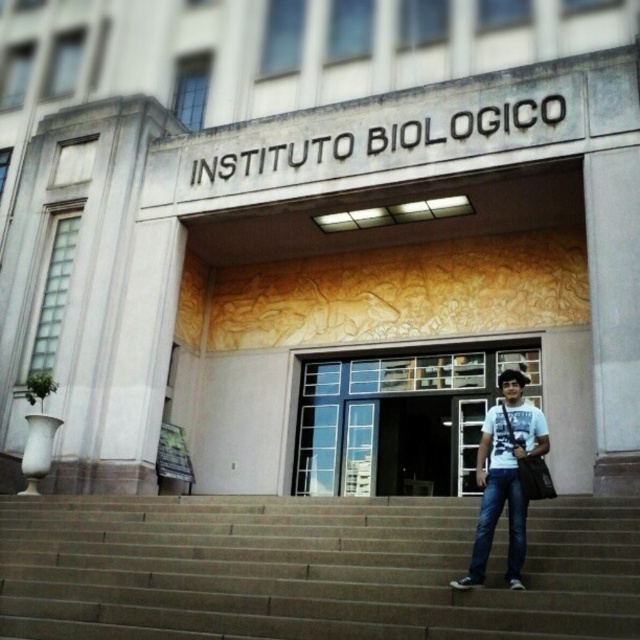
You are standing at the entrance of the Instituto Biologico and want to take a photo of both the decorative relief panel above the double doors and the person on the steps. Which of the two points, point (76,532) or point (433,465), should you focus on first to ensure both are in clear view?

Point (76,532) is closer to the viewer than point (433,465), so you should focus on point (76,532) first to ensure both are in clear view.